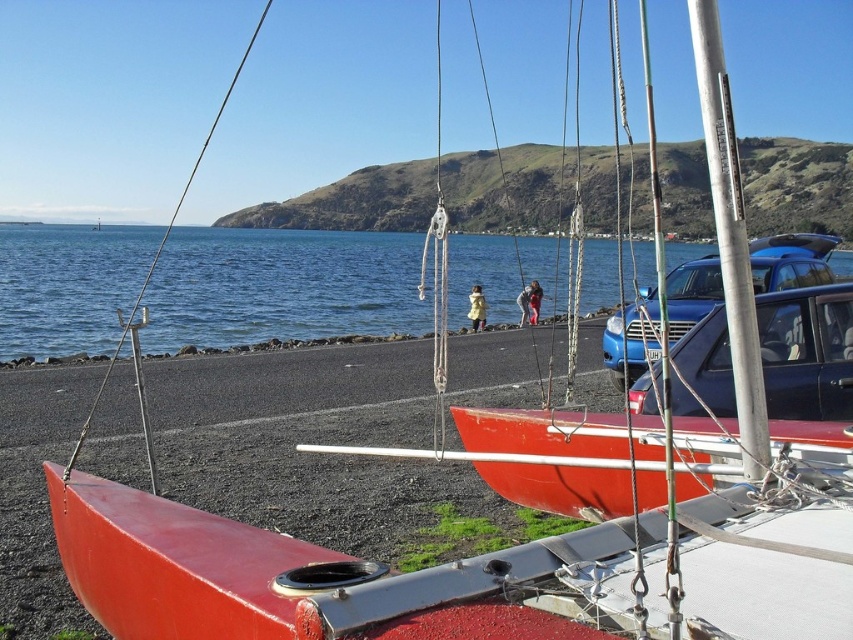
Question: Which point is closer to the camera?

Choices:
 (A) (360, 328)
 (B) (607, 333)

Answer: (B)

Question: Which point is closer to the camera?

Choices:
 (A) blue metallic car at center
 (B) blue water at center

Answer: (B)

Question: Is blue water at center wider than blue metallic car at center?

Choices:
 (A) no
 (B) yes

Answer: (B)

Question: Does blue water at center appear on the left side of blue metallic car at center?

Choices:
 (A) yes
 (B) no

Answer: (A)

Question: Which object is closer to the camera taking this photo?

Choices:
 (A) blue water at center
 (B) blue metallic car at center

Answer: (A)

Question: In this image, where is blue water at center located relative to blue metallic car at center?

Choices:
 (A) right
 (B) left

Answer: (B)